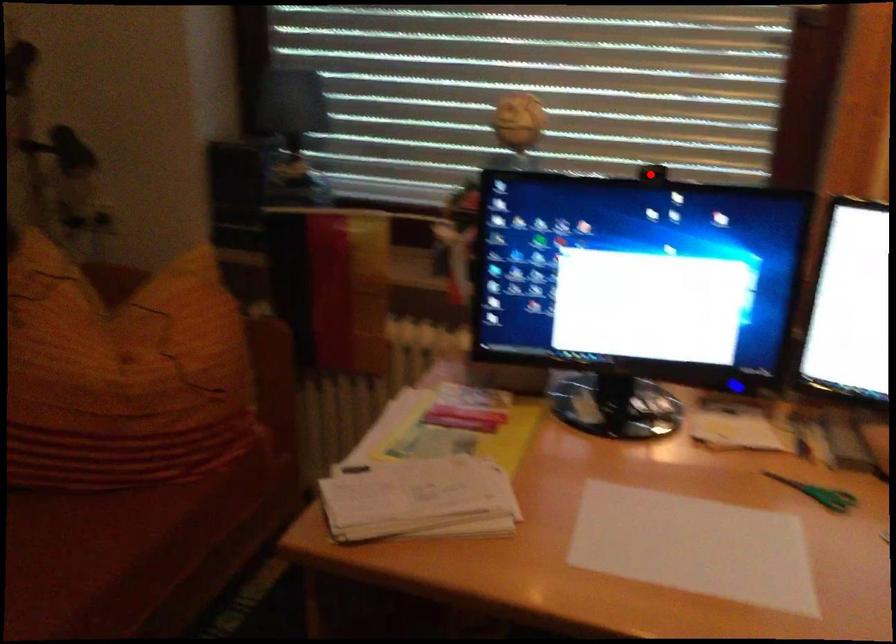
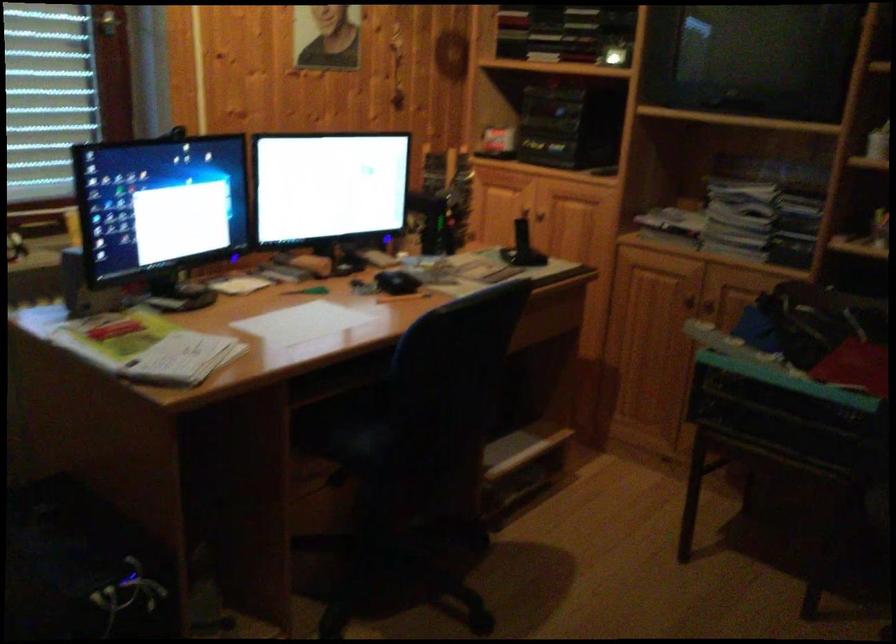
Question: I am providing you with two images of the same scene from different viewpoints. A red point is marked on the first image. At the location where the point appears in image 1, is it still visible in image 2?

Choices:
 (A) Yes
 (B) No

Answer: (B)